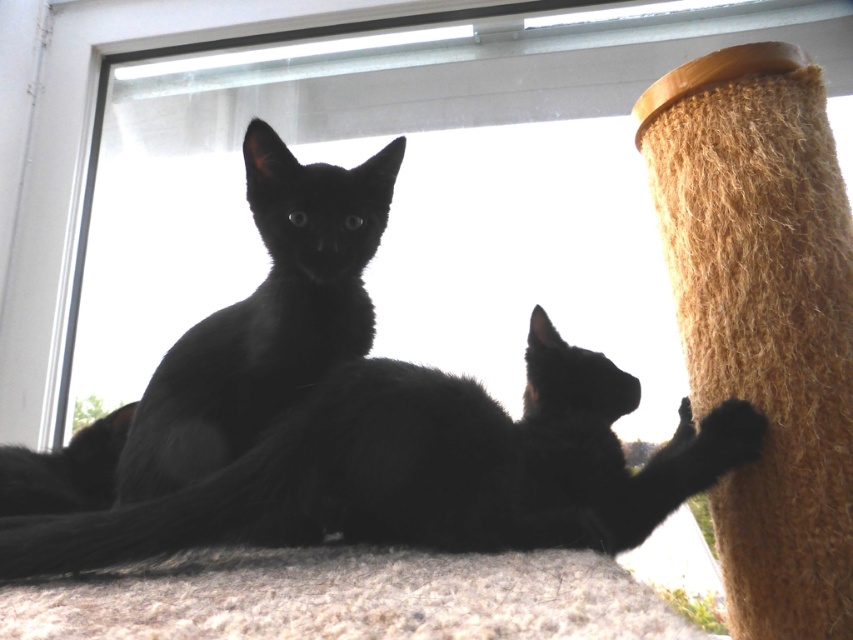
Question: Which object is the farthest from the black fur cat at center?

Choices:
 (A) transparent glass door at upper center
 (B) black fur cat at upper left

Answer: (A)

Question: Which object appears farthest from the camera in this image?

Choices:
 (A) black fur cat at upper left
 (B) transparent glass door at upper center
 (C) black fur cat at center

Answer: (B)

Question: Considering the relative positions of transparent glass door at upper center and black fur cat at upper left in the image provided, where is transparent glass door at upper center located with respect to black fur cat at upper left?

Choices:
 (A) below
 (B) above

Answer: (B)

Question: Is black fur cat at center to the left of black fur cat at upper left from the viewer's perspective?

Choices:
 (A) no
 (B) yes

Answer: (A)

Question: Among these objects, which one is farthest from the camera?

Choices:
 (A) black fur cat at center
 (B) black fur cat at upper left
 (C) transparent glass door at upper center

Answer: (C)

Question: Can you confirm if transparent glass door at upper center is positioned to the left of black fur cat at upper left?

Choices:
 (A) yes
 (B) no

Answer: (B)